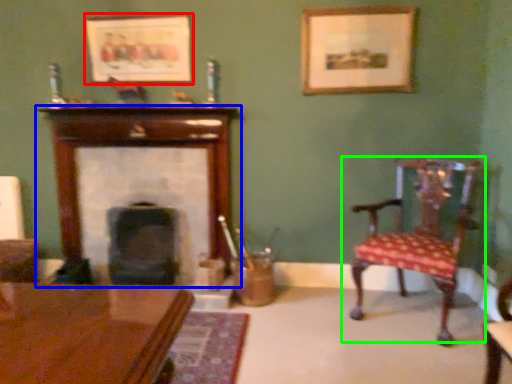
Question: Considering the real-world distances, which object is closest to picture frame (highlighted by a red box)? fireplace (highlighted by a blue box) or chair (highlighted by a green box).

Choices:
 (A) fireplace
 (B) chair

Answer: (A)